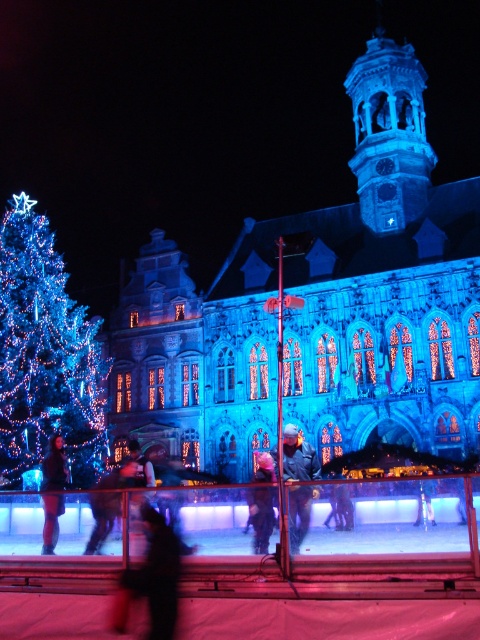
Between dark brown leather jacket at center and dark blue fabric jacket at center, which one appears on the right side from the viewer's perspective?

dark blue fabric jacket at center is more to the right.

Can you confirm if dark brown leather jacket at center is positioned to the right of dark blue fabric jacket at center?

In fact, dark brown leather jacket at center is to the left of dark blue fabric jacket at center.

Who is more distant from viewer, [51,465] or [252,516]?

Positioned behind is point [51,465].

At what (x,y) coordinates should I click in order to perform the action: click on dark brown leather jacket at center. Please return your answer as a coordinate pair (x, y). The image size is (480, 640). Looking at the image, I should click on (55, 467).

Which is behind, point (91, 378) or point (260, 547)?

Point (91, 378)

Between illuminated glass christmas tree at left and dark blue fabric jacket at center, which one has more height?

With more height is illuminated glass christmas tree at left.

Is point (0, 428) behind point (265, 472)?

Yes, point (0, 428) is behind point (265, 472).

Find the location of a particular element. The height and width of the screenshot is (640, 480). illuminated glass christmas tree at left is located at coordinates 46,355.

Can you confirm if dark blue leather jacket at center is taller than dark brown leather jacket at center?

No.

Does dark blue leather jacket at center appear over dark brown leather jacket at center?

Yes, dark blue leather jacket at center is above dark brown leather jacket at center.

Between point (294, 467) and point (60, 445), which one is positioned behind?

Point (60, 445)

Image resolution: width=480 pixels, height=640 pixels. Identify the location of dark blue leather jacket at center. (299, 456).